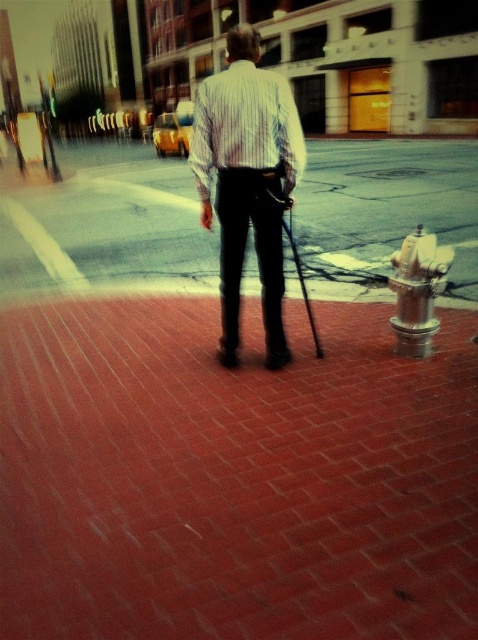
You are a delivery person trying to place a small package on the brick at center and the striped cotton shirt at center. Which object can the package fit on?

The striped cotton shirt at center is larger than the brick at center, so the package can fit on the striped cotton shirt at center.

You are a delivery robot with a height of 1.2 meters. You need to deliver a package to the person standing on the brick pavement at center. The striped cotton shirt at center is part of their clothing. Can you see the person from your current position? Explain why.

The brick pavement at center has a greater height compared to striped cotton shirt at center. Since the brick pavement is taller than the person wearing the striped cotton shirt, the delivery robot might not be able to see the person if the pavement obstructs the line of sight. However, since the person is standing on the pavement, their height would likely be above the pavement, so the robot should still be able to see them unless the pavement itself is a barrier.